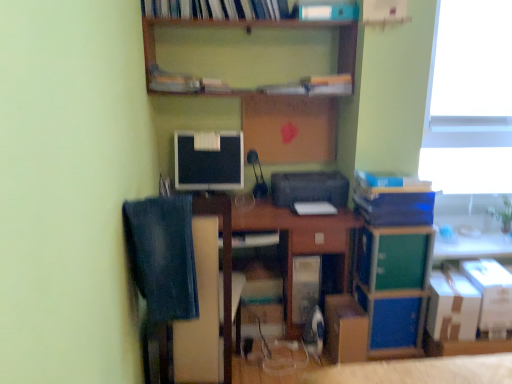
Question: From a real-world perspective, relative to cardboard box at lower center, the first cardboard box in the left-to-right sequence, is blue matte book at upper right, marked as the 4th book in a left-to-right arrangement, vertically above or below?

Choices:
 (A) above
 (B) below

Answer: (A)

Question: In terms of width, does blue matte book at upper right, the 1th book from the right, look wider or thinner when compared to cardboard box at lower center, the 3th cardboard box viewed from the right?

Choices:
 (A) thin
 (B) wide

Answer: (A)

Question: Which object is the farthest from the white cardboard box at lower right, placed as the 2th cardboard box when sorted from right to left?

Choices:
 (A) denim at left
 (B) white cardboard box at lower right, arranged as the first cardboard box when viewed from the right
 (C) cardboard box at lower center, the 3th cardboard box viewed from the right
 (D) wooden at upper center
 (E) blue matte book at upper right, acting as the third book starting from the top

Answer: (D)

Question: Which of these objects is positioned farthest from the satin black monitor at center?

Choices:
 (A) hardcover book at upper center, the first book positioned from the left
 (B) green matte cabinet at lower right
 (C) wooden at upper center
 (D) white cardboard box at lower right, the third cardboard box positioned from the left
 (E) cardboard box at lower center, the first cardboard box in the left-to-right sequence

Answer: (D)